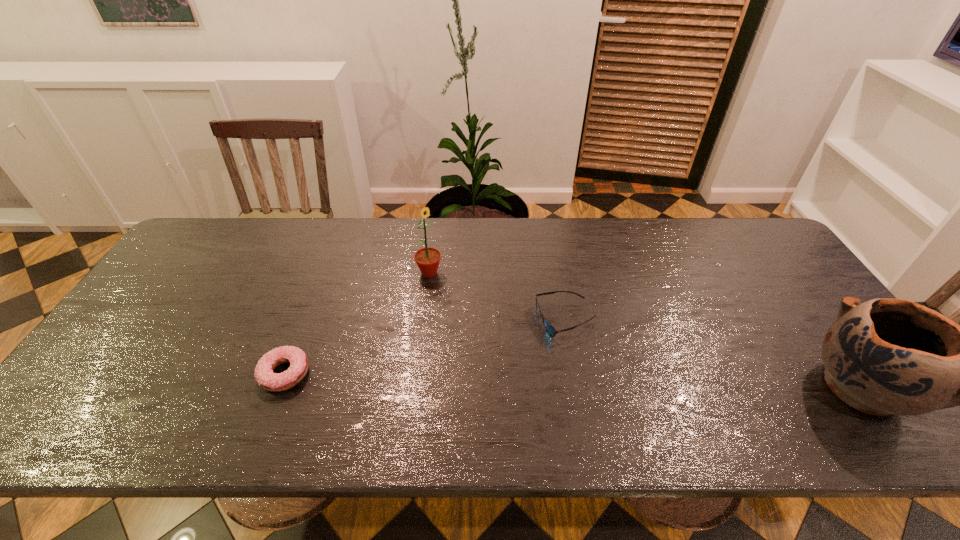
This screenshot has width=960, height=540. Find the location of `doughnut`. doughnut is located at coordinates (267, 379).

Find the location of a particular element. the rightmost object is located at coordinates (886, 356).

You are a GUI agent. You are given a task and a screenshot of the screen. Output one action in this format:
    pyautogui.click(x=<x>, y=<y>)
    Task: Click on the third nearest object
    This screenshot has height=540, width=960.
    Given the screenshot: What is the action you would take?
    pyautogui.click(x=550, y=329)

Identify the location of the second object from right to left. The height and width of the screenshot is (540, 960). (550, 329).

I want to click on the third object from right to left, so click(427, 259).

The width and height of the screenshot is (960, 540). In order to click on sunflower in this screenshot , I will do `click(427, 259)`.

Where is `vacant space located on the left of the doughnut`? vacant space located on the left of the doughnut is located at coordinates (194, 374).

You are a GUI agent. You are given a task and a screenshot of the screen. Output one action in this format:
    pyautogui.click(x=<x>, y=<y>)
    Task: Click on the blank space located on the back of the pottery
    
    Given the screenshot: What is the action you would take?
    pyautogui.click(x=819, y=329)

In order to click on vacant area situated 0.180m at the front of the second object from right to left showing the lenses in this screenshot , I will do `click(510, 384)`.

At what (x,y) coordinates should I click in order to perform the action: click on vacant space located at the front of the second object from right to left showing the lenses. Please return your answer as a coordinate pair (x, y). Image resolution: width=960 pixels, height=540 pixels. Looking at the image, I should click on (529, 362).